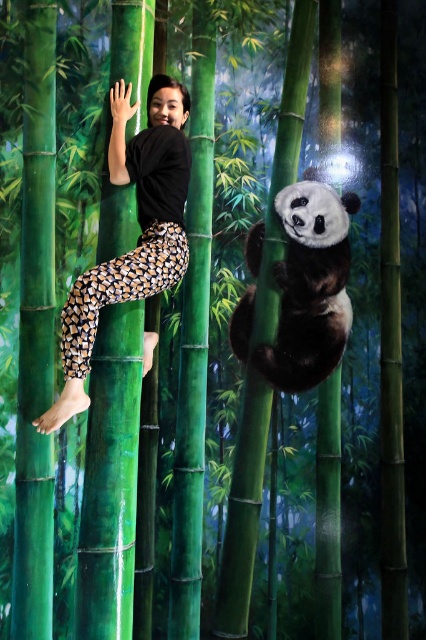
Question: Is black matte leggings at upper center to the left of fluffy white panda at right from the viewer's perspective?

Choices:
 (A) yes
 (B) no

Answer: (A)

Question: Is black matte leggings at upper center further to the viewer compared to fluffy white panda at right?

Choices:
 (A) yes
 (B) no

Answer: (B)

Question: Considering the relative positions of black matte leggings at upper center and fluffy white panda at right in the image provided, where is black matte leggings at upper center located with respect to fluffy white panda at right?

Choices:
 (A) below
 (B) above

Answer: (B)

Question: Which object is farther from the camera taking this photo?

Choices:
 (A) fluffy white panda at right
 (B) black matte leggings at upper center

Answer: (A)